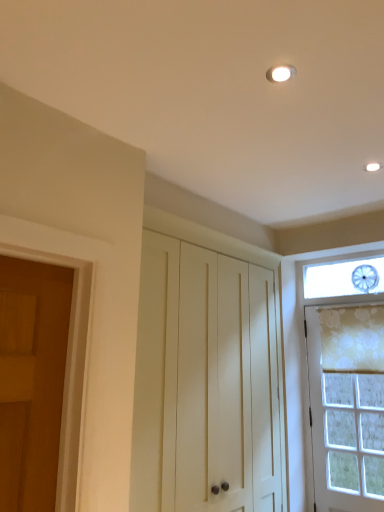
What do you see at coordinates (352, 339) in the screenshot? The image size is (384, 512). I see `floral fabric curtain at right` at bounding box center [352, 339].

Find the location of a particular element. This screenshot has height=512, width=384. white textured door at right is located at coordinates (347, 406).

Which object is closer to the camera, floral fabric curtain at right or white textured door at right?

white textured door at right is closer to the camera.

What's the angular difference between floral fabric curtain at right and white textured door at right's facing directions?

floral fabric curtain at right and white textured door at right are facing 0.627 degrees away from each other.

Between point (332, 358) and point (321, 371), which one is positioned in front?

The point (332, 358) is closer.

Considering the relative positions of white wood cabinet at center and white textured door at right in the image provided, is white wood cabinet at center in front of white textured door at right?

That is True.

What's the angular difference between white wood cabinet at center and white textured door at right's facing directions?

They differ by 90.8 degrees in their facing directions.

Who is bigger, white wood cabinet at center or white textured door at right?

white wood cabinet at center is bigger.

Is white textured door at right at the back of white wood cabinet at center?

No, white wood cabinet at center is not facing the opposite direction of white textured door at right.

Is white wood cabinet at center oriented towards floral fabric curtain at right?

Yes.

From the picture: Is white wood cabinet at center positioned far away from floral fabric curtain at right?

No, white wood cabinet at center is not far away from floral fabric curtain at right.

Based on their sizes in the image, would you say white wood cabinet at center is bigger or smaller than floral fabric curtain at right?

In the image, white wood cabinet at center appears to be larger than floral fabric curtain at right.

Image resolution: width=384 pixels, height=512 pixels. In the image, there is a white wood cabinet at center. Find the location of `curtain above it (from the image's perspective)`. curtain above it (from the image's perspective) is located at coordinates (352, 339).

Who is more distant, floral fabric curtain at right or white wood cabinet at center?

floral fabric curtain at right is further from the camera.

Can you tell me how much floral fabric curtain at right and white wood cabinet at center differ in facing direction?

The facing directions of floral fabric curtain at right and white wood cabinet at center are 91.5 degrees apart.

Which of these two, floral fabric curtain at right or white wood cabinet at center, is smaller?

floral fabric curtain at right.

How many degrees apart are the facing directions of white textured door at right and floral fabric curtain at right?

white textured door at right and floral fabric curtain at right are facing 0.627 degrees away from each other.

Is white textured door at right facing away from floral fabric curtain at right?

Yes, white textured door at right is positioned with its back facing floral fabric curtain at right.

From a real-world perspective, is white textured door at right above or below floral fabric curtain at right?

white textured door at right is below floral fabric curtain at right.

Considering the relative sizes of white textured door at right and floral fabric curtain at right in the image provided, is white textured door at right thinner than floral fabric curtain at right?

Incorrect, the width of white textured door at right is not less than that of floral fabric curtain at right.

Is white wood cabinet at center completely or partially inside white textured door at right?

No, white wood cabinet at center is not a part of white textured door at right.

Which is behind, white textured door at right or white wood cabinet at center?

white textured door at right is more distant.

The height and width of the screenshot is (512, 384). Find the location of `door lying below the white wood cabinet at center (from the image's perspective)`. door lying below the white wood cabinet at center (from the image's perspective) is located at coordinates (347, 406).

The width and height of the screenshot is (384, 512). What are the coordinates of `door below the floral fabric curtain at right (from the image's perspective)` in the screenshot? It's located at (347, 406).

Find the location of `door that is on the right side of white wood cabinet at center`. door that is on the right side of white wood cabinet at center is located at coordinates (347, 406).

Considering their positions, is white wood cabinet at center positioned closer to floral fabric curtain at right than white textured door at right?

Based on the image, white textured door at right appears to be nearer to floral fabric curtain at right.

When comparing their distances from white wood cabinet at center, does floral fabric curtain at right or white textured door at right seem closer?

white textured door at right is closer to white wood cabinet at center.

From the image, which object appears to be farther from white wood cabinet at center, white textured door at right or floral fabric curtain at right?

floral fabric curtain at right lies further to white wood cabinet at center than the other object.

Which object lies nearer to the anchor point floral fabric curtain at right, white textured door at right or white wood cabinet at center?

Among the two, white textured door at right is located nearer to floral fabric curtain at right.

Based on their spatial positions, is white wood cabinet at center or floral fabric curtain at right closer to white textured door at right?

floral fabric curtain at right.

Estimate the real-world distances between objects in this image. Which object is further from white textured door at right, floral fabric curtain at right or white wood cabinet at center?

white wood cabinet at center.

At what (x,y) coordinates should I click in order to perform the action: click on door located between white wood cabinet at center and floral fabric curtain at right in the left-right direction. Please return your answer as a coordinate pair (x, y). The image size is (384, 512). Looking at the image, I should click on (347, 406).